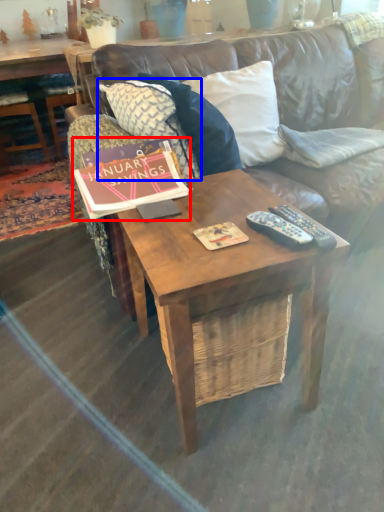
Question: Which object is closer to the camera taking this photo, book (highlighted by a red box) or pillow (highlighted by a blue box)?

Choices:
 (A) book
 (B) pillow

Answer: (A)